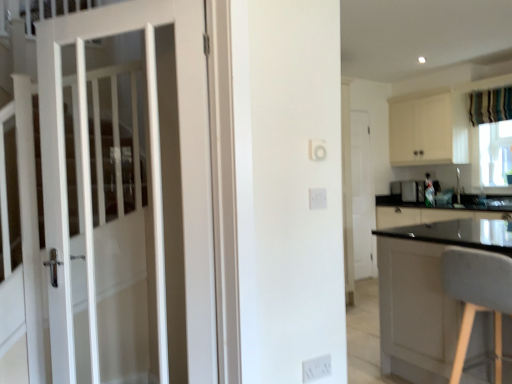
Question: From a real-world perspective, is gray fabric chair at right on white plastic electric outlet at lower center?

Choices:
 (A) yes
 (B) no

Answer: (A)

Question: Considering the relative sizes of gray fabric chair at right and white plastic electric outlet at lower center in the image provided, is gray fabric chair at right thinner than white plastic electric outlet at lower center?

Choices:
 (A) yes
 (B) no

Answer: (B)

Question: Is gray fabric chair at right positioned beyond the bounds of white plastic electric outlet at lower center?

Choices:
 (A) no
 (B) yes

Answer: (B)

Question: Is gray fabric chair at right wider than white plastic electric outlet at lower center?

Choices:
 (A) no
 (B) yes

Answer: (B)

Question: Is the surface of gray fabric chair at right in direct contact with white plastic electric outlet at lower center?

Choices:
 (A) no
 (B) yes

Answer: (A)

Question: Is gray fabric chair at right at the right side of white plastic electric outlet at lower center?

Choices:
 (A) yes
 (B) no

Answer: (A)

Question: Is striped fabric curtain at upper right bigger than white matte door at center, the 1th door viewed from the right?

Choices:
 (A) yes
 (B) no

Answer: (B)

Question: Considering the relative positions of striped fabric curtain at upper right and white matte door at center, arranged as the 1th door when viewed from the back, in the image provided, is striped fabric curtain at upper right behind white matte door at center, arranged as the 1th door when viewed from the back,?

Choices:
 (A) yes
 (B) no

Answer: (B)

Question: From the image's perspective, is striped fabric curtain at upper right under white matte door at center, arranged as the 1th door when viewed from the back?

Choices:
 (A) no
 (B) yes

Answer: (A)

Question: Is striped fabric curtain at upper right to the right of white matte door at center, the 1th door viewed from the right, from the viewer's perspective?

Choices:
 (A) yes
 (B) no

Answer: (A)

Question: Does striped fabric curtain at upper right have a smaller size compared to white matte door at center, the 2th door positioned from the left?

Choices:
 (A) no
 (B) yes

Answer: (B)

Question: Considering the relative positions of striped fabric curtain at upper right and white matte door at center, marked as the 2th door in a front-to-back arrangement, in the image provided, is striped fabric curtain at upper right to the left of white matte door at center, marked as the 2th door in a front-to-back arrangement, from the viewer's perspective?

Choices:
 (A) yes
 (B) no

Answer: (B)

Question: From a real-world perspective, is transparent plastic window screen at right physically below gray fabric chair at right?

Choices:
 (A) yes
 (B) no

Answer: (B)